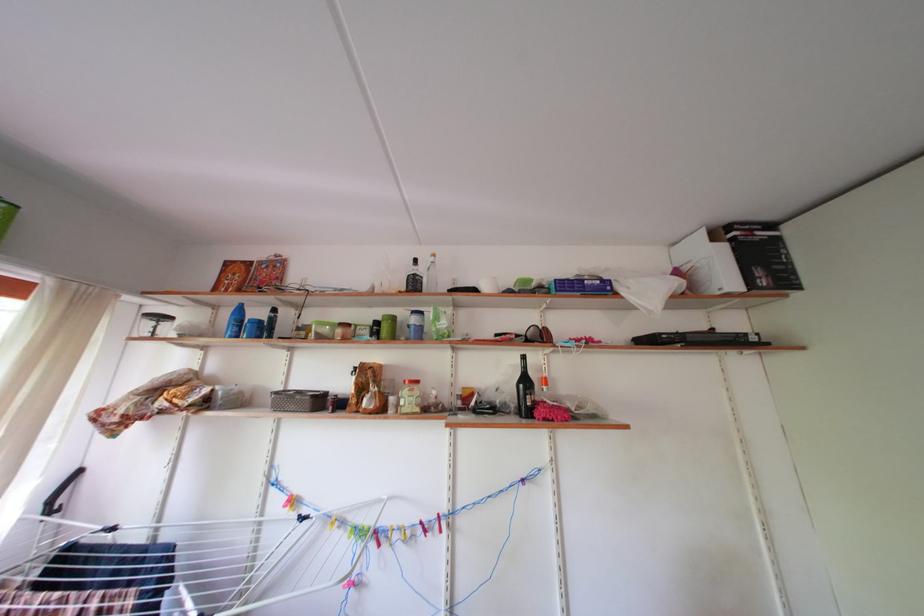
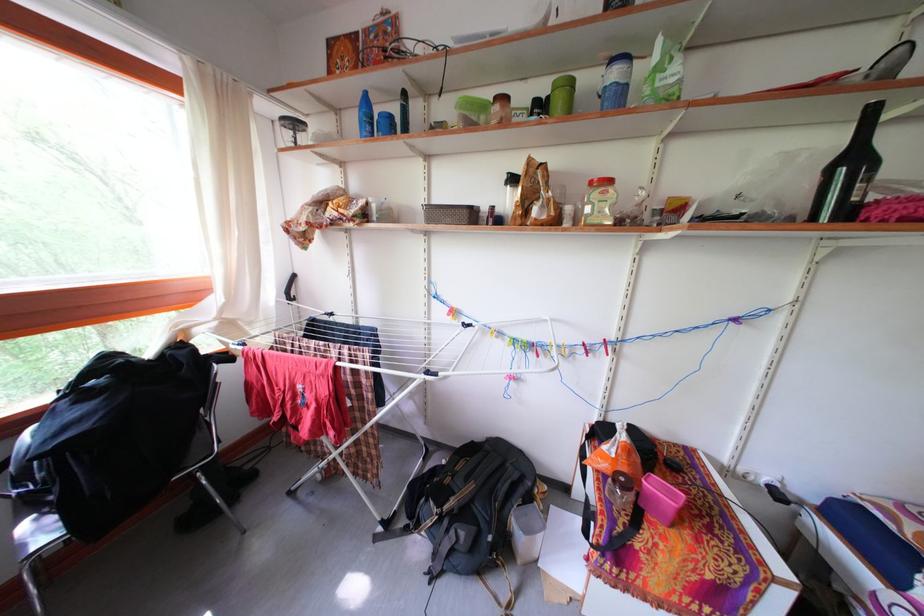
In the second image, find the point that corresponds to [440,407] in the first image.

(638, 216)